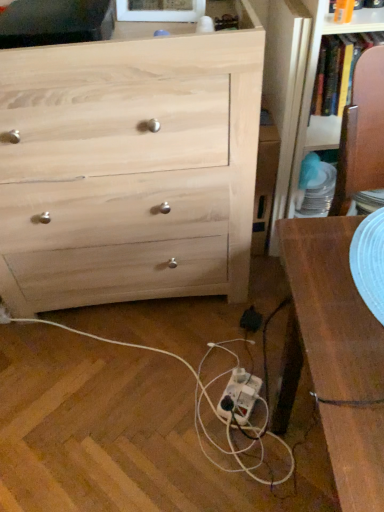
Question: Is natural wood chest of drawers at upper left at the left side of white plastic extension cord at lower center?

Choices:
 (A) no
 (B) yes

Answer: (B)

Question: Is white plastic extension cord at lower center at the back of natural wood chest of drawers at upper left?

Choices:
 (A) yes
 (B) no

Answer: (B)

Question: From a real-world perspective, is natural wood chest of drawers at upper left over white plastic extension cord at lower center?

Choices:
 (A) no
 (B) yes

Answer: (B)

Question: Is natural wood chest of drawers at upper left not within white plastic extension cord at lower center?

Choices:
 (A) no
 (B) yes

Answer: (B)

Question: Are natural wood chest of drawers at upper left and white plastic extension cord at lower center located far from each other?

Choices:
 (A) yes
 (B) no

Answer: (B)

Question: In terms of width, does natural wood chest of drawers at upper left look wider or thinner when compared to white plastic extension cord at lower center?

Choices:
 (A) thin
 (B) wide

Answer: (B)

Question: From their relative heights in the image, would you say natural wood chest of drawers at upper left is taller or shorter than white plastic extension cord at lower center?

Choices:
 (A) short
 (B) tall

Answer: (B)

Question: Is natural wood chest of drawers at upper left inside or outside of white plastic extension cord at lower center?

Choices:
 (A) outside
 (B) inside

Answer: (A)

Question: Based on their positions, is natural wood chest of drawers at upper left located to the left or right of white plastic extension cord at lower center?

Choices:
 (A) right
 (B) left

Answer: (B)

Question: Considering the positions of point (231, 382) and point (233, 414), is point (231, 382) closer or farther from the camera than point (233, 414)?

Choices:
 (A) closer
 (B) farther

Answer: (B)

Question: In terms of height, does white plastic extension cord at lower center look taller or shorter compared to white plastic power strip at lower center?

Choices:
 (A) short
 (B) tall

Answer: (B)

Question: Is white plastic extension cord at lower center in front of or behind white plastic power strip at lower center in the image?

Choices:
 (A) front
 (B) behind

Answer: (B)

Question: Visually, is white plastic extension cord at lower center positioned to the left or to the right of white plastic power strip at lower center?

Choices:
 (A) right
 (B) left

Answer: (A)

Question: From a real-world perspective, is white plastic power strip at lower center positioned above or below natural wood chest of drawers at upper left?

Choices:
 (A) below
 (B) above

Answer: (A)

Question: Visually, is white plastic power strip at lower center positioned to the left or to the right of natural wood chest of drawers at upper left?

Choices:
 (A) left
 (B) right

Answer: (B)